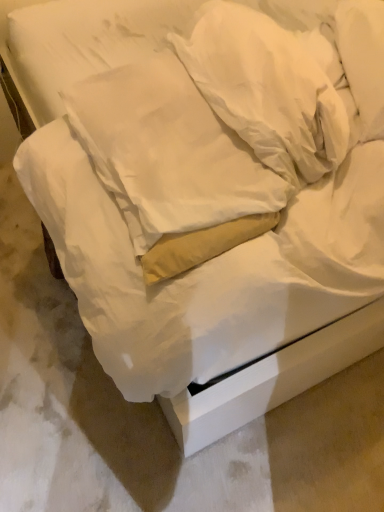
Question: In terms of width, does white soft pillow at upper center, which is the second pillow in left-to-right order, look wider or thinner when compared to white soft pillow at center, the second pillow in the right-to-left sequence?

Choices:
 (A) thin
 (B) wide

Answer: (A)

Question: Considering their positions, is white soft pillow at upper center, which is the second pillow in left-to-right order, located in front of or behind white soft pillow at center, which appears as the 1th pillow when viewed from the left?

Choices:
 (A) behind
 (B) front

Answer: (A)

Question: Visually, is white soft pillow at upper center, which is the second pillow in left-to-right order, positioned to the left or to the right of white soft pillow at center, which appears as the 1th pillow when viewed from the left?

Choices:
 (A) left
 (B) right

Answer: (B)

Question: Looking at the image, does white soft pillow at center, the second pillow in the right-to-left sequence, seem bigger or smaller compared to white soft pillow at upper center, which is the second pillow in left-to-right order?

Choices:
 (A) small
 (B) big

Answer: (B)

Question: Would you say white soft pillow at center, the second pillow in the right-to-left sequence, is to the left or to the right of white soft pillow at upper center, which is the second pillow in left-to-right order, in the picture?

Choices:
 (A) left
 (B) right

Answer: (A)

Question: From the image's perspective, is white soft pillow at center, which appears as the 1th pillow when viewed from the left, located above or below white soft pillow at upper center, which is the second pillow in left-to-right order?

Choices:
 (A) above
 (B) below

Answer: (B)

Question: In terms of width, does white soft pillow at center, the second pillow in the right-to-left sequence, look wider or thinner when compared to white soft pillow at upper center, which is the second pillow in left-to-right order?

Choices:
 (A) wide
 (B) thin

Answer: (A)